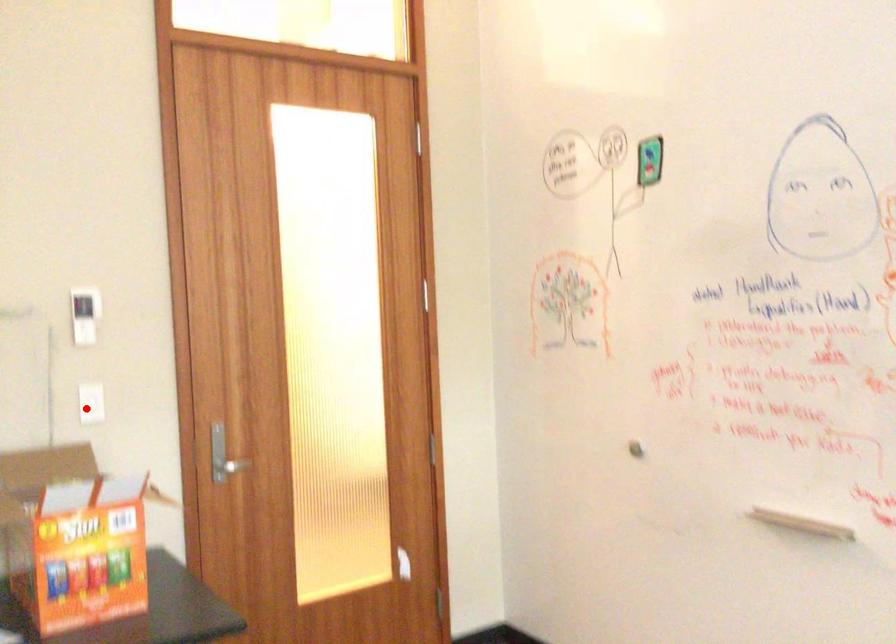
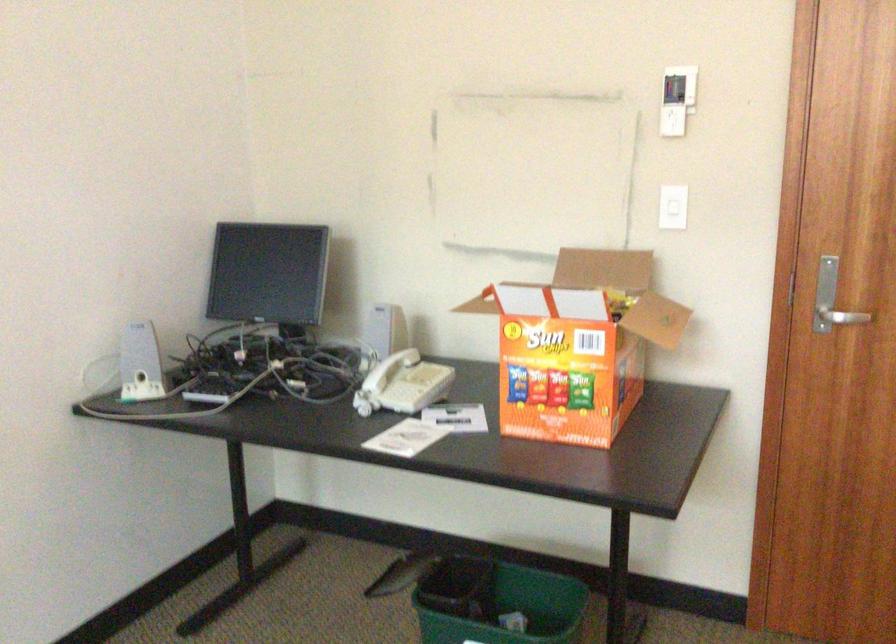
Where in the second image is the point corresponding to the highlighted location from the first image?

(672, 214)